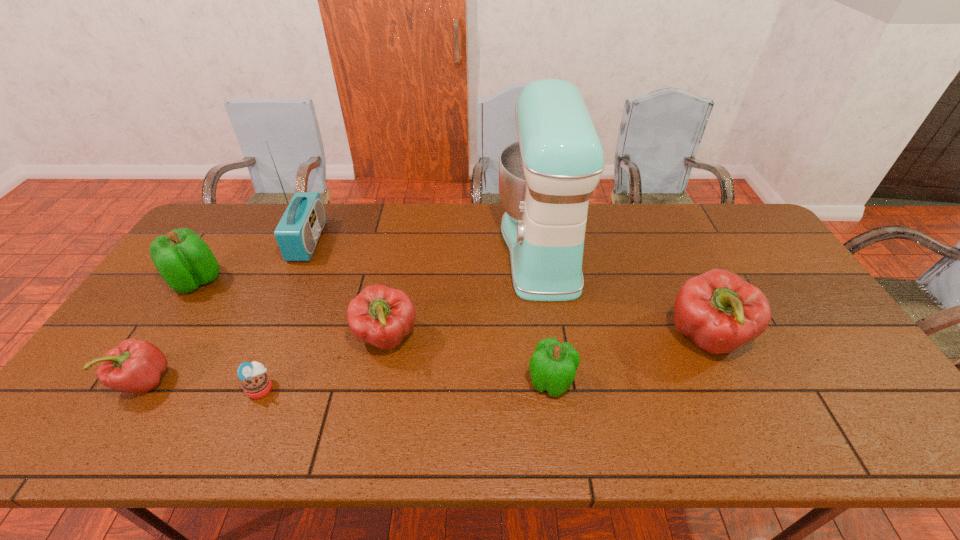
Locate an element on the screen. free space that satisfies the following two spatial constraints: 1. on the front panel of the third bell pepper from left to right; 2. on the left side of the light radio receiver is located at coordinates (265, 338).

Where is `vacant space that satisfies the following two spatial constraints: 1. on the front panel of the second smallest pink bell pepper; 2. on the left side of the light radio receiver`? This screenshot has height=540, width=960. vacant space that satisfies the following two spatial constraints: 1. on the front panel of the second smallest pink bell pepper; 2. on the left side of the light radio receiver is located at coordinates (265, 338).

This screenshot has width=960, height=540. In order to click on free space that satisfies the following two spatial constraints: 1. at the base of the tallest object; 2. on the right side of the rightmost object in this screenshot , I will do `click(556, 339)`.